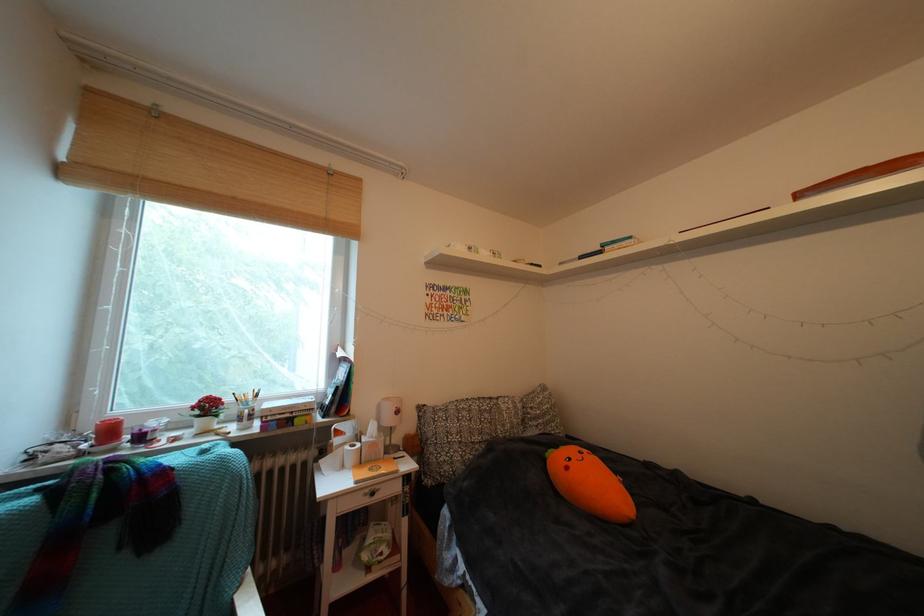
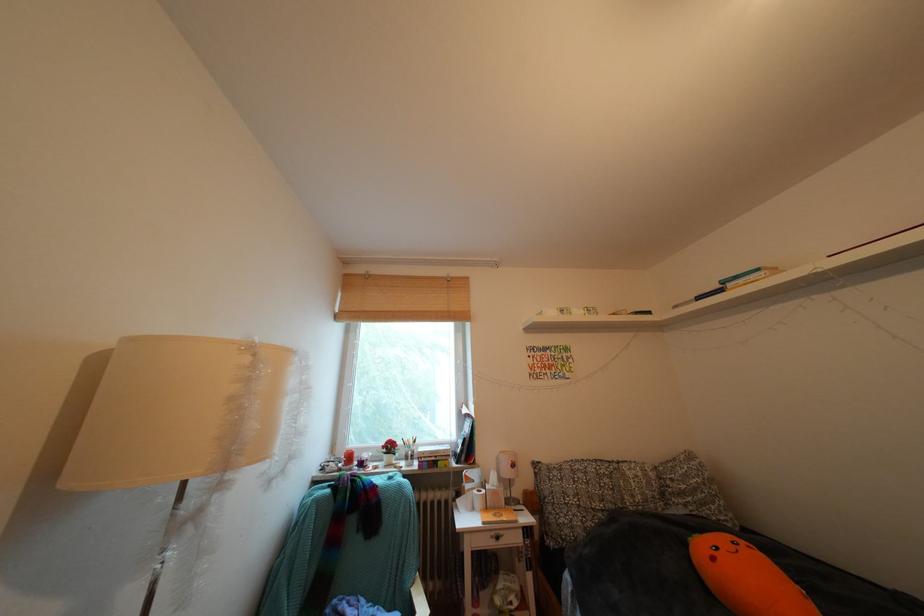
Find the pixel in the second image that matches (342,407) in the first image.

(472, 456)